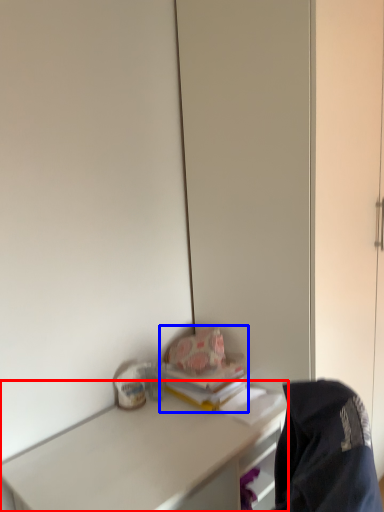
Question: Among these objects, which one is farthest to the camera, desk (highlighted by a red box) or book (highlighted by a blue box)?

Choices:
 (A) desk
 (B) book

Answer: (B)